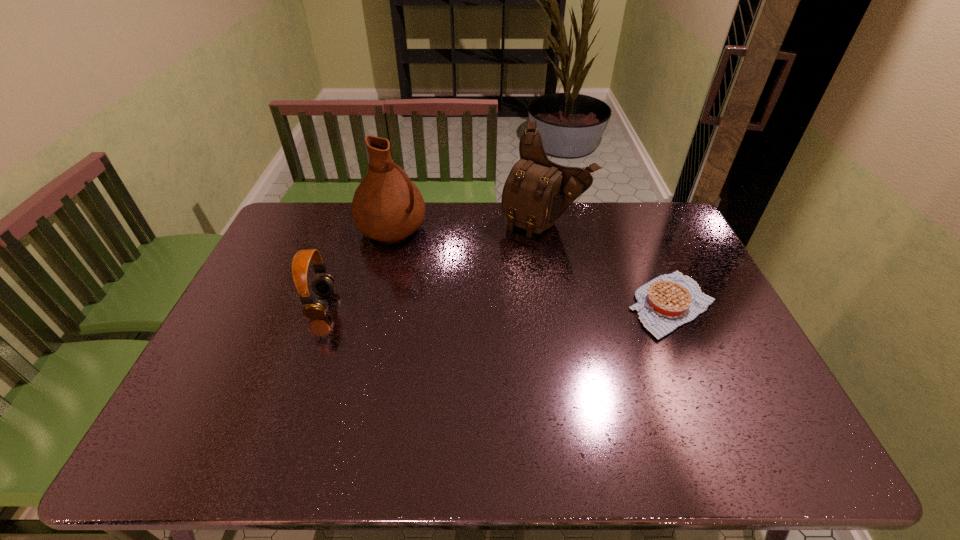
Where is `free region at the near left corner of the desktop`? This screenshot has width=960, height=540. free region at the near left corner of the desktop is located at coordinates (195, 400).

The image size is (960, 540). What are the coordinates of `vacant space at the far right corner of the desktop` in the screenshot? It's located at (633, 213).

Locate an element on the screen. vacant region at the near right corner of the desktop is located at coordinates (745, 410).

You are a GUI agent. You are given a task and a screenshot of the screen. Output one action in this format:
    pyautogui.click(x=<x>, y=<y>)
    Task: Click on the free point between the headset and the rightmost object
    
    Given the screenshot: What is the action you would take?
    pyautogui.click(x=497, y=305)

Identify the location of free spot between the third tallest object and the pitcher. (357, 267).

Locate an element on the screen. Image resolution: width=960 pixels, height=540 pixels. vacant space in between the third tallest object and the shoulder bag is located at coordinates (433, 263).

Where is `empty space that is in between the headset and the shortest object`? Image resolution: width=960 pixels, height=540 pixels. empty space that is in between the headset and the shortest object is located at coordinates (497, 305).

Locate an element on the screen. The width and height of the screenshot is (960, 540). vacant region between the shoulder bag and the pitcher is located at coordinates (468, 225).

Where is `vacant space that is in between the headset and the pitcher`? The height and width of the screenshot is (540, 960). vacant space that is in between the headset and the pitcher is located at coordinates (357, 267).

You are a GUI agent. You are given a task and a screenshot of the screen. Output one action in this format:
    pyautogui.click(x=<x>, y=<y>)
    Task: Click on the vacant area that lies between the rightmost object and the headset
    
    Given the screenshot: What is the action you would take?
    pyautogui.click(x=497, y=305)